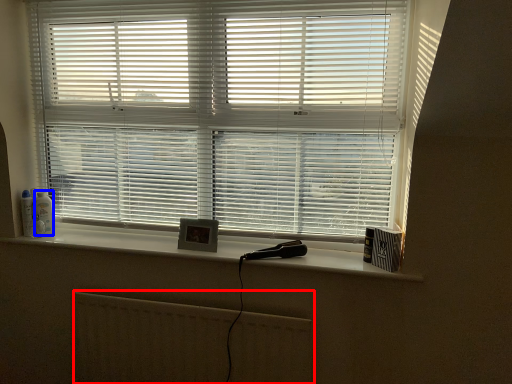
Question: Which of the following is the farthest to the observer, radiator (highlighted by a red box) or toiletry (highlighted by a blue box)?

Choices:
 (A) radiator
 (B) toiletry

Answer: (B)